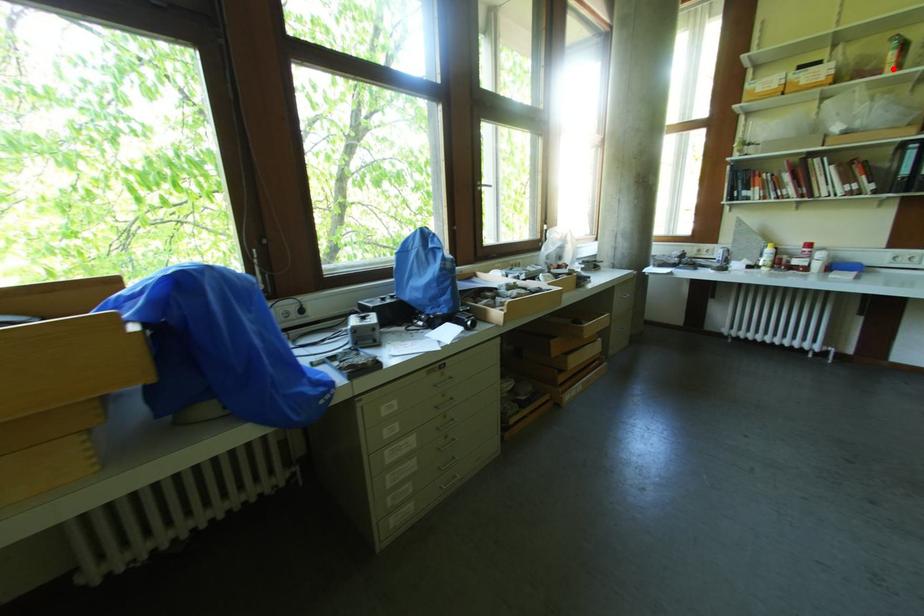
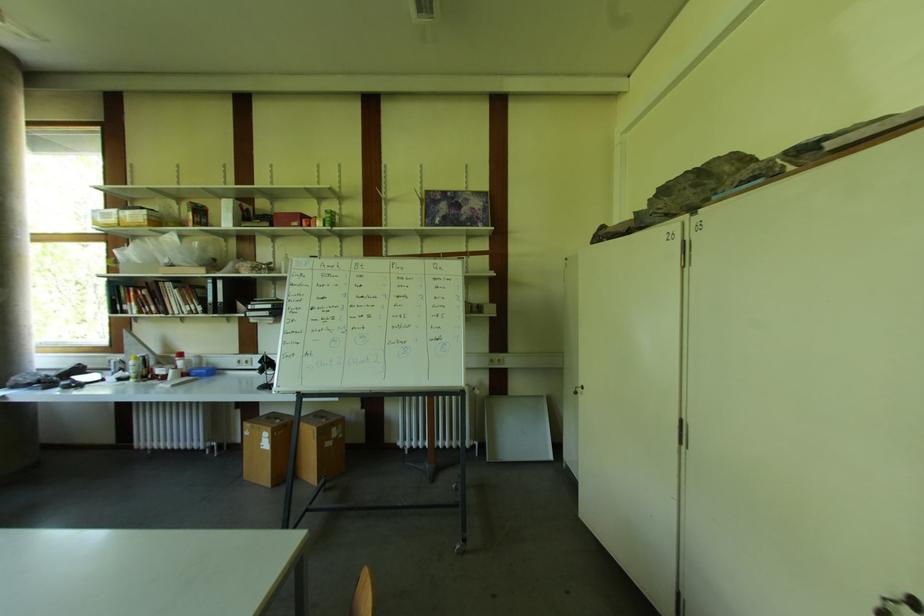
Find the pixel in the second image that matches the highlighted location in the first image.

(193, 225)